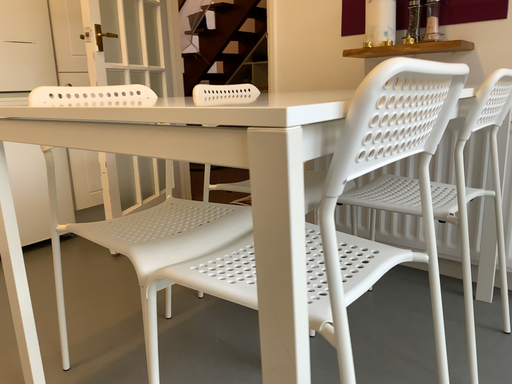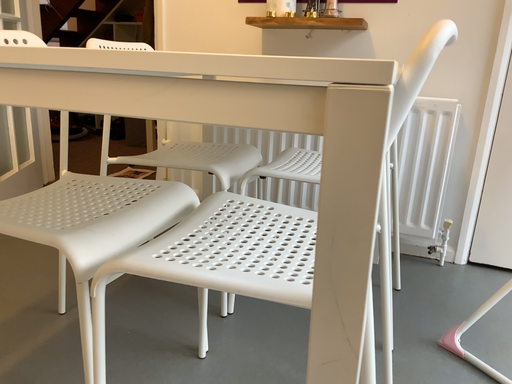
Question: How did the camera likely rotate when shooting the video?

Choices:
 (A) rotated right
 (B) rotated left

Answer: (A)